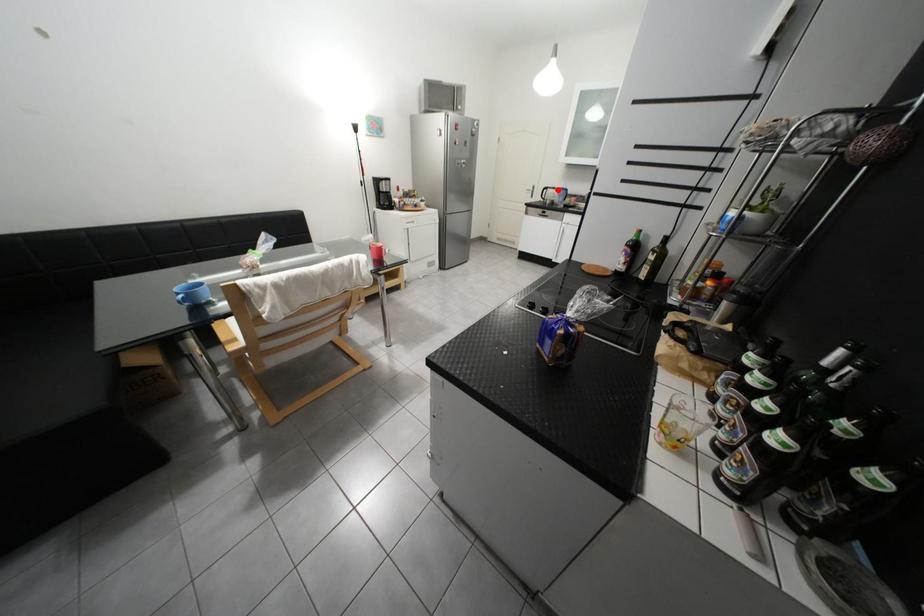
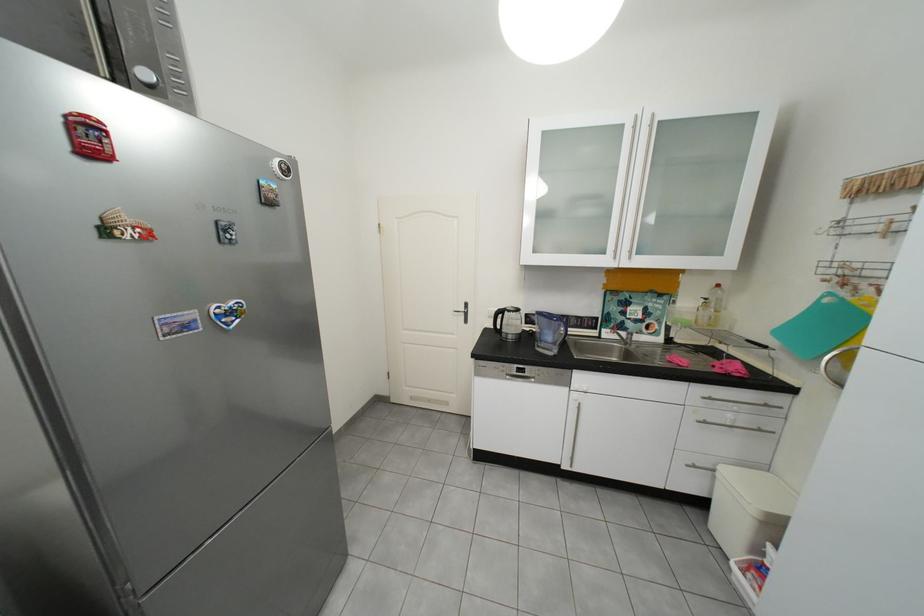
Locate, in the second image, the point that corresponds to the highlighted location in the first image.

(513, 313)